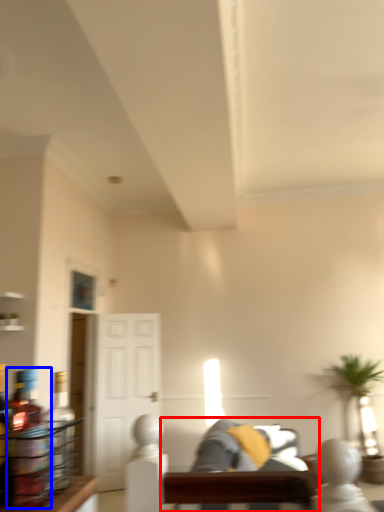
Question: Which point is closer to the camera, couch (highlighted by a red box) or bottle (highlighted by a blue box)?

Choices:
 (A) couch
 (B) bottle

Answer: (B)